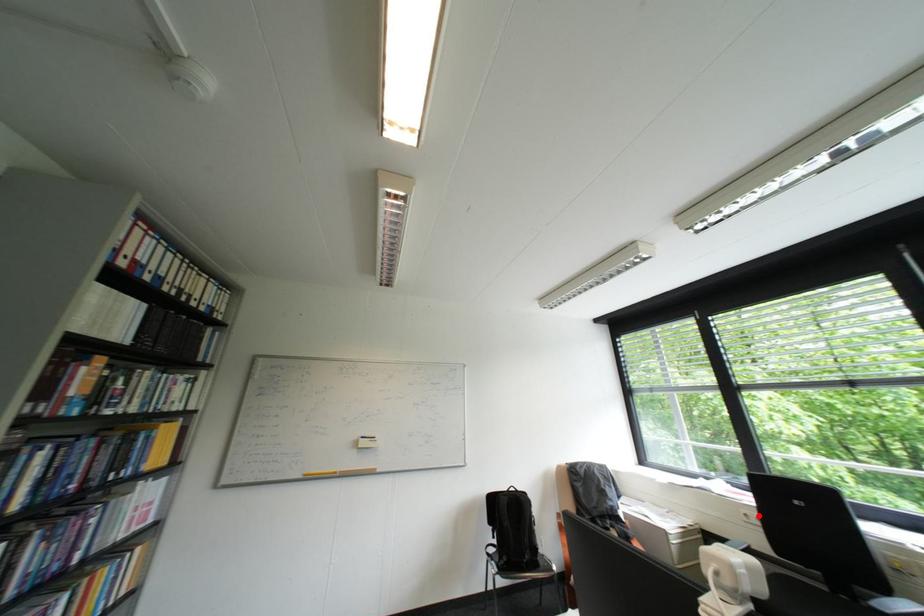
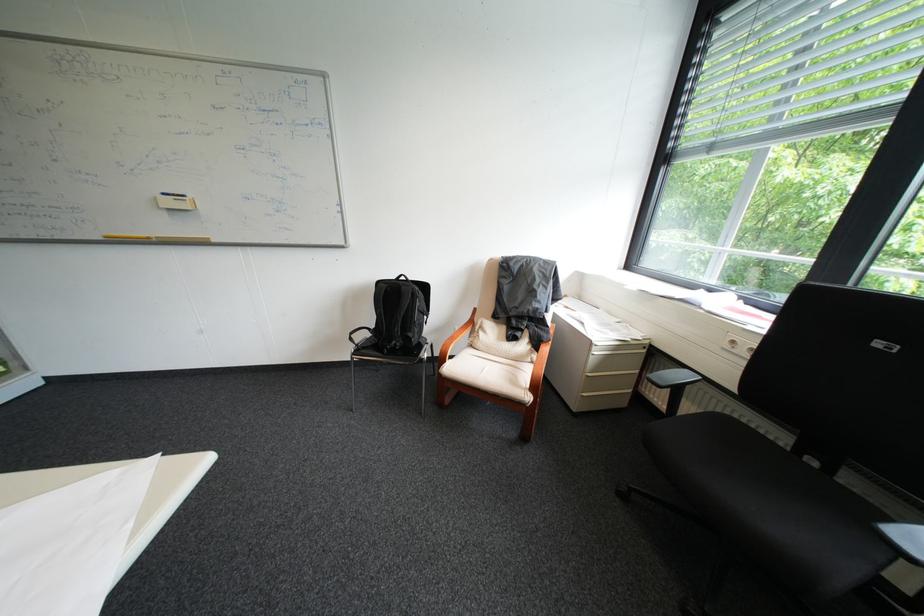
Question: I am providing you with two images of the same scene from different viewpoints. A red point is marked on the first image. Is the red point's position out of view in image 2?

Choices:
 (A) Yes
 (B) No

Answer: (B)